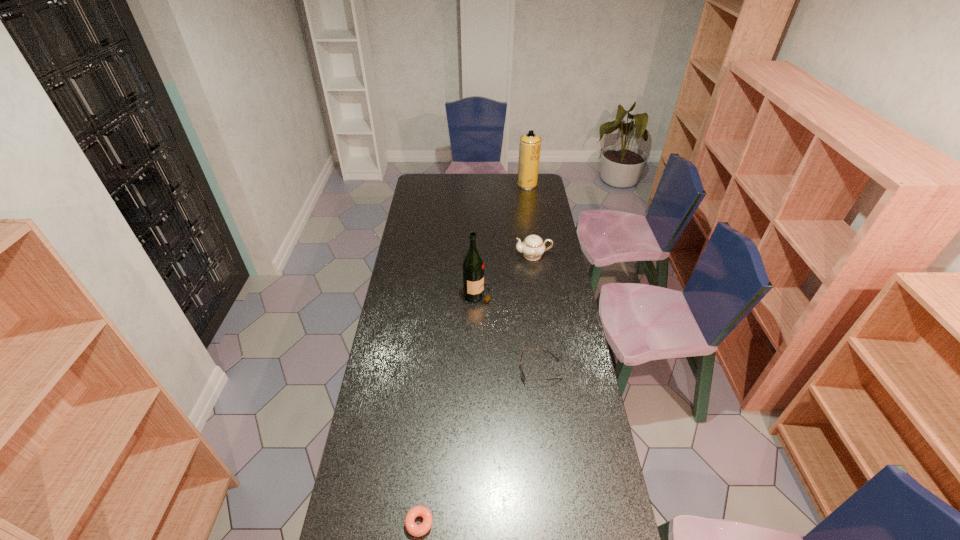
Image resolution: width=960 pixels, height=540 pixels. I want to click on vacant space located 0.290m on the surface of the fourth object from right to left, so click(x=557, y=294).

This screenshot has height=540, width=960. Identify the location of vacant space situated 0.290m at the spout of the third tallest object. (457, 255).

This screenshot has height=540, width=960. In order to click on blank space located at the spout of the third tallest object in this screenshot , I will do `click(487, 255)`.

Where is `vacant space located at the spout of the third tallest object`? vacant space located at the spout of the third tallest object is located at coordinates (487, 255).

You are a GUI agent. You are given a task and a screenshot of the screen. Output one action in this format:
    pyautogui.click(x=<x>, y=<y>)
    Task: Click on the blank area located on the front-facing side of the sunglasses
    
    Given the screenshot: What is the action you would take?
    pyautogui.click(x=454, y=370)

This screenshot has width=960, height=540. I want to click on vacant space situated on the front-facing side of the sunglasses, so click(x=436, y=370).

Identify the location of vacant space located 0.260m on the front-facing side of the sunglasses. (451, 370).

Where is `free space located 0.330m on the right of the shortest object`? free space located 0.330m on the right of the shortest object is located at coordinates (546, 523).

Find the location of a particular element. object that is at the far edge is located at coordinates (529, 150).

Locate an element on the screen. The height and width of the screenshot is (540, 960). aerosol can that is positioned at the right edge is located at coordinates (529, 150).